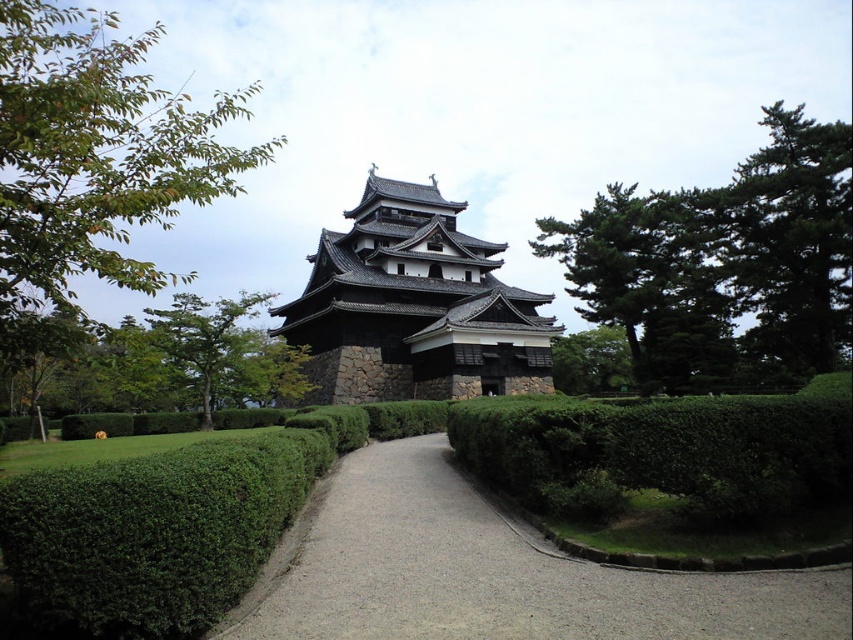
Question: Considering the real-world distances, which object is farthest from the green leafy hedge at center?

Choices:
 (A) green leafy tree at left
 (B) green leafy tree at upper center
 (C) green leafy tree at upper right
 (D) dark gray stone pagoda at center

Answer: (B)

Question: Is green leafy tree at upper right wider than green textured tree at upper right?

Choices:
 (A) no
 (B) yes

Answer: (B)

Question: Can you confirm if green leafy tree at upper right is smaller than green leafy tree at center?

Choices:
 (A) yes
 (B) no

Answer: (B)

Question: Can you confirm if green leafy tree at upper right is positioned below green leafy tree at center?

Choices:
 (A) no
 (B) yes

Answer: (A)

Question: Which of these objects is positioned farthest from the green leafy tree at center?

Choices:
 (A) green leafy hedge at center
 (B) green textured tree at upper right

Answer: (B)

Question: Which object appears farthest from the camera in this image?

Choices:
 (A) green leafy tree at center
 (B) green leafy hedge at center
 (C) green leafy tree at upper right
 (D) green leafy tree at left

Answer: (C)